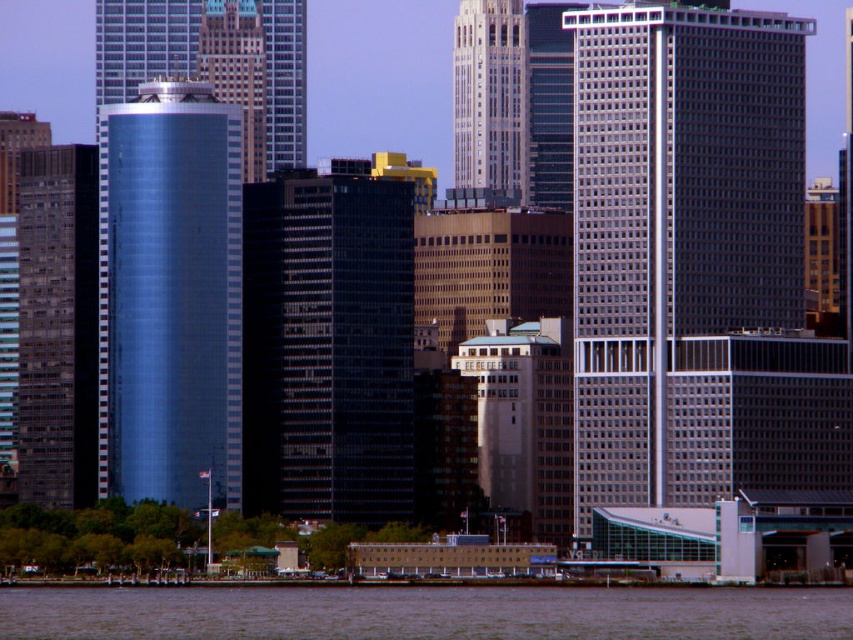
Who is more distant from viewer, (728, 186) or (488, 100)?

The point (728, 186) is behind.

Is point (749, 310) behind point (521, 16)?

That is False.

Does point (751, 120) come behind point (480, 80)?

That is True.

Identify the location of gray glass skyscraper at center. The image size is (853, 640). (675, 221).

Who is taller, marble-like beige skyscraper at center or gold textured building at upper center?

marble-like beige skyscraper at center

Can you confirm if marble-like beige skyscraper at center is positioned to the right of gold textured building at upper center?

Correct, you'll find marble-like beige skyscraper at center to the right of gold textured building at upper center.

The height and width of the screenshot is (640, 853). Find the location of `marble-like beige skyscraper at center`. marble-like beige skyscraper at center is located at coordinates (489, 97).

You are a GUI agent. You are given a task and a screenshot of the screen. Output one action in this format:
    pyautogui.click(x=<x>, y=<y>)
    Task: Click on the black glass building at center
    This screenshot has width=853, height=640.
    Given the screenshot: What is the action you would take?
    pyautogui.click(x=328, y=348)

Looking at this image, who is lower down, black glass building at center or dark gray concrete building at left?

black glass building at center

What do you see at coordinates (328, 348) in the screenshot? I see `black glass building at center` at bounding box center [328, 348].

Image resolution: width=853 pixels, height=640 pixels. I want to click on black glass building at center, so click(x=328, y=348).